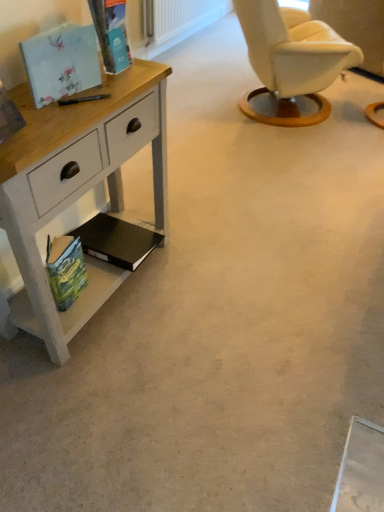
The width and height of the screenshot is (384, 512). In order to click on vacant space in front of matte floral-patterned book at upper left, the 2th magazine from the top in this screenshot , I will do `click(61, 119)`.